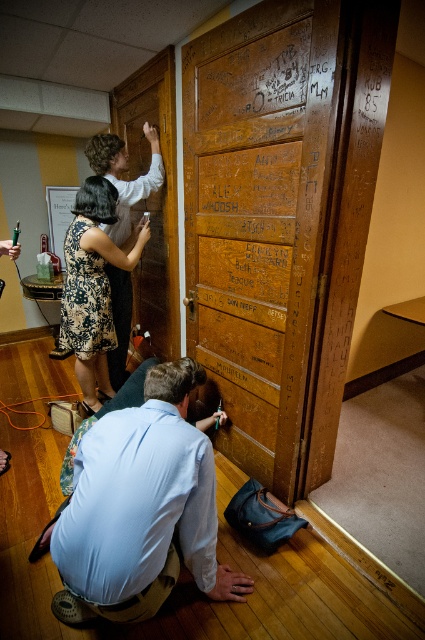
Question: Among these points, which one is nearest to the camera?

Choices:
 (A) (167, 566)
 (B) (169, 237)

Answer: (A)

Question: Is the position of wooden door at center less distant than that of floral dress at center?

Choices:
 (A) no
 (B) yes

Answer: (B)

Question: Which of these objects is positioned closest to the wooden door at center?

Choices:
 (A) floral dress at center
 (B) wooden door at upper center
 (C) light blue shirt at lower center

Answer: (A)

Question: Is wooden door at upper center behind floral dress at center?

Choices:
 (A) no
 (B) yes

Answer: (B)

Question: Estimate the real-world distances between objects in this image. Which object is closer to the floral dress at center?

Choices:
 (A) light blue shirt at lower center
 (B) wooden door at upper center

Answer: (B)

Question: From the image, what is the correct spatial relationship of wooden door at upper center in relation to floral dress at center?

Choices:
 (A) left
 (B) right

Answer: (B)